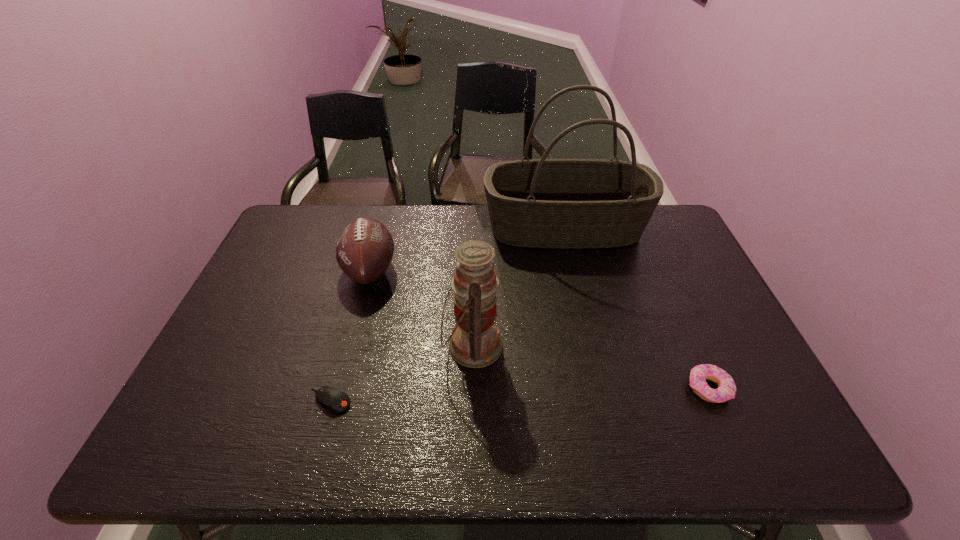
Identify the location of basket. The width and height of the screenshot is (960, 540). (543, 203).

The width and height of the screenshot is (960, 540). I want to click on oil lamp, so click(x=475, y=342).

Locate an element on the screen. The image size is (960, 540). the third shortest object is located at coordinates (364, 250).

In order to click on doughnut in this screenshot , I will do `click(726, 390)`.

Where is `the shortest object`? The image size is (960, 540). the shortest object is located at coordinates (335, 400).

Image resolution: width=960 pixels, height=540 pixels. Identify the location of free point located 0.050m on the left of the basket. (468, 228).

Locate an element on the screen. The image size is (960, 540). vacant point located 0.060m on the right of the fourth shortest object is located at coordinates (526, 346).

Identify the location of vacant space located on the back of the third tallest object. (385, 214).

At what (x,y) coordinates should I click in order to perform the action: click on vacant region located 0.390m on the back of the doughnut. Please return your answer as a coordinate pair (x, y). Looking at the image, I should click on (656, 266).

Find the location of a particular element. free space located 0.160m on the left of the shortest object is located at coordinates (238, 401).